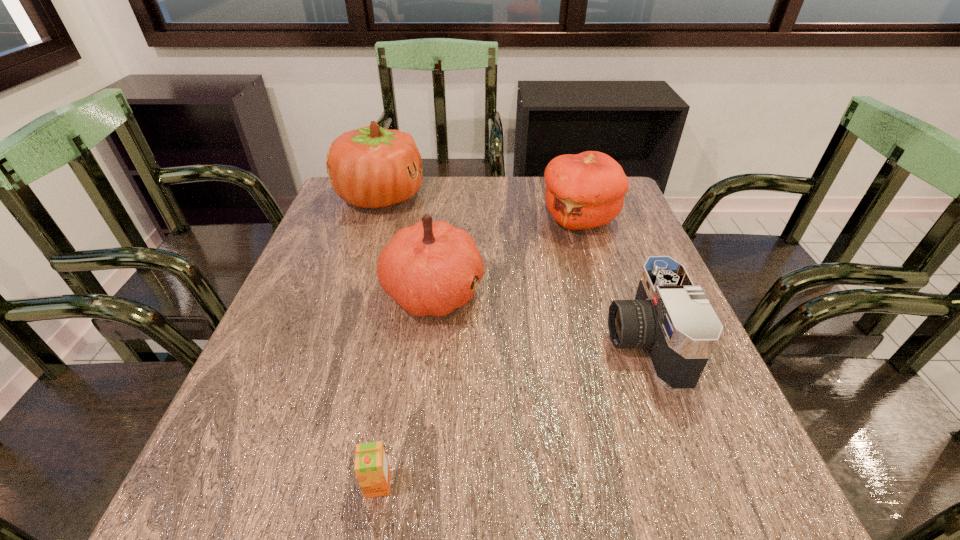
Locate an element on the screen. vacant point located on the back of the nearest object is located at coordinates (409, 307).

The height and width of the screenshot is (540, 960). Find the location of `object present at the near edge`. object present at the near edge is located at coordinates (371, 466).

At what (x,y) coordinates should I click in order to perform the action: click on object situated at the left edge. Please return your answer as a coordinate pair (x, y). The height and width of the screenshot is (540, 960). Looking at the image, I should click on (370, 167).

Identify the location of pumpkin that is positioned at the right edge. (586, 190).

The height and width of the screenshot is (540, 960). What are the coordinates of `camera that is at the right edge` in the screenshot? It's located at click(671, 318).

The height and width of the screenshot is (540, 960). Find the location of `object present at the far left corner`. object present at the far left corner is located at coordinates (370, 167).

Image resolution: width=960 pixels, height=540 pixels. Identify the location of object that is at the far right corner. point(586,190).

In the image, there is a desktop. Identify the location of vacant space at the far edge. (472, 219).

Where is `vacant position at the near edge of the desktop`? The image size is (960, 540). vacant position at the near edge of the desktop is located at coordinates (342, 501).

Locate an element on the screen. free space at the left edge of the desktop is located at coordinates (361, 274).